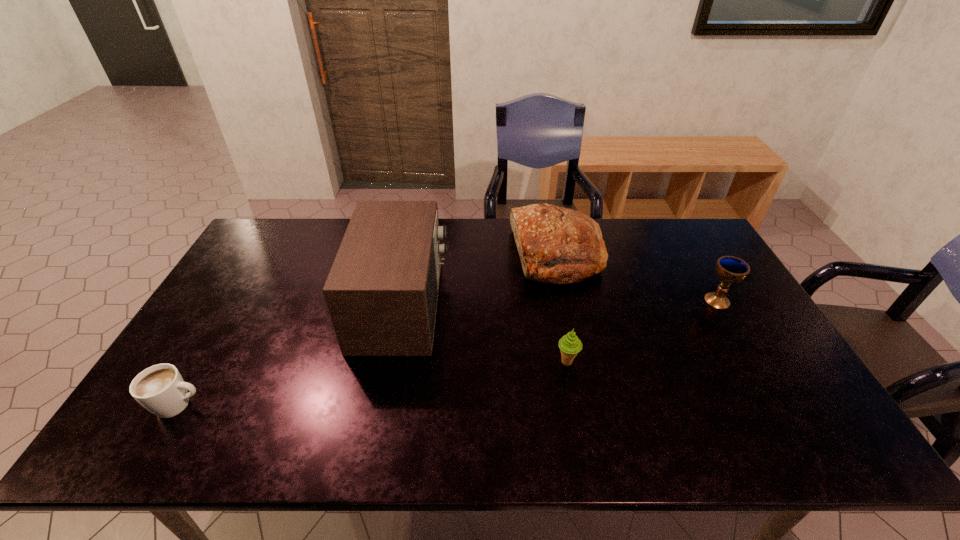
Find the location of a particular element. This screenshot has width=960, height=540. free location at the near edge of the desktop is located at coordinates (454, 433).

Find the location of a particular element. Image resolution: width=960 pixels, height=540 pixels. vacant space at the right edge of the desktop is located at coordinates (714, 325).

The height and width of the screenshot is (540, 960). In order to click on free space at the near left corner in this screenshot , I will do `click(184, 425)`.

Locate an element on the screen. This screenshot has width=960, height=540. empty space that is in between the rightmost object and the radio receiver is located at coordinates (560, 302).

You are a GUI agent. You are given a task and a screenshot of the screen. Output one action in this format:
    pyautogui.click(x=<x>, y=<y>)
    Task: Click on the vacant point located between the icecream and the chalice
    The image size is (960, 540).
    Given the screenshot: What is the action you would take?
    pyautogui.click(x=642, y=331)

At what (x,y) coordinates should I click in order to perform the action: click on free space between the cappuccino and the tallest object. Please return your answer as a coordinate pair (x, y). The width and height of the screenshot is (960, 540). Looking at the image, I should click on (290, 354).

At what (x,y) coordinates should I click in order to perform the action: click on empty space that is in between the second tallest object and the chalice. Please return your answer as a coordinate pair (x, y). The width and height of the screenshot is (960, 540). Looking at the image, I should click on (637, 278).

Find the location of a particular element. Image resolution: width=960 pixels, height=540 pixels. unoccupied position between the bread and the icecream is located at coordinates (562, 309).

Image resolution: width=960 pixels, height=540 pixels. Find the location of `vacant area that lies between the icecream and the rightmost object`. vacant area that lies between the icecream and the rightmost object is located at coordinates (642, 331).

The width and height of the screenshot is (960, 540). Find the location of `vacant space that is in between the fourth shortest object and the radio receiver`. vacant space that is in between the fourth shortest object and the radio receiver is located at coordinates (479, 280).